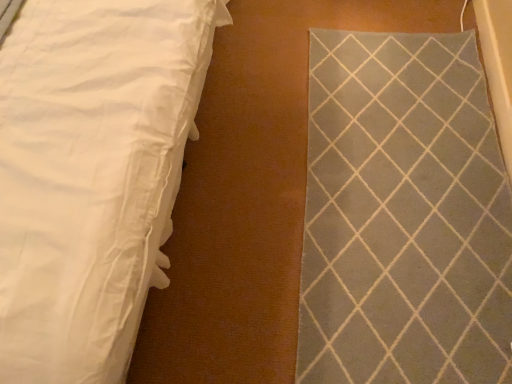
The width and height of the screenshot is (512, 384). What do you see at coordinates (91, 175) in the screenshot?
I see `white cotton bed at left` at bounding box center [91, 175].

Where is `white cotton bed at left`? white cotton bed at left is located at coordinates (91, 175).

Locate an element on the screen. Image resolution: width=512 pixels, height=384 pixels. white cotton bed at left is located at coordinates (91, 175).